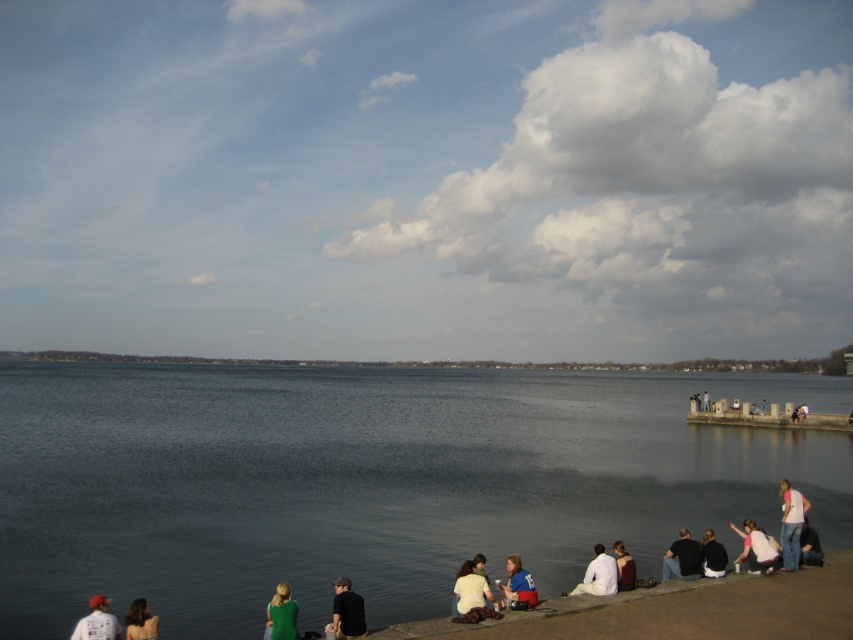
Question: Can you confirm if white cotton shirt at lower center is positioned above dark brown leather jacket at lower center?

Choices:
 (A) no
 (B) yes

Answer: (A)

Question: Is white matte shirt at lower right to the left of white cotton shirt at lower center from the viewer's perspective?

Choices:
 (A) no
 (B) yes

Answer: (A)

Question: Which point is closer to the camera?

Choices:
 (A) (595, 584)
 (B) (473, 600)
 (C) (521, 588)

Answer: (B)

Question: Is matte white cap at lower left below denim jacket at lower right?

Choices:
 (A) no
 (B) yes

Answer: (A)

Question: Which point appears closest to the camera in this image?

Choices:
 (A) (x=91, y=632)
 (B) (x=813, y=540)
 (C) (x=473, y=561)

Answer: (A)

Question: Which point is closer to the camera?

Choices:
 (A) green fabric shirt at lower left
 (B) dark blue shirt at lower center
 (C) green matte dress at lower center
 (D) denim jacket at lower right

Answer: (A)